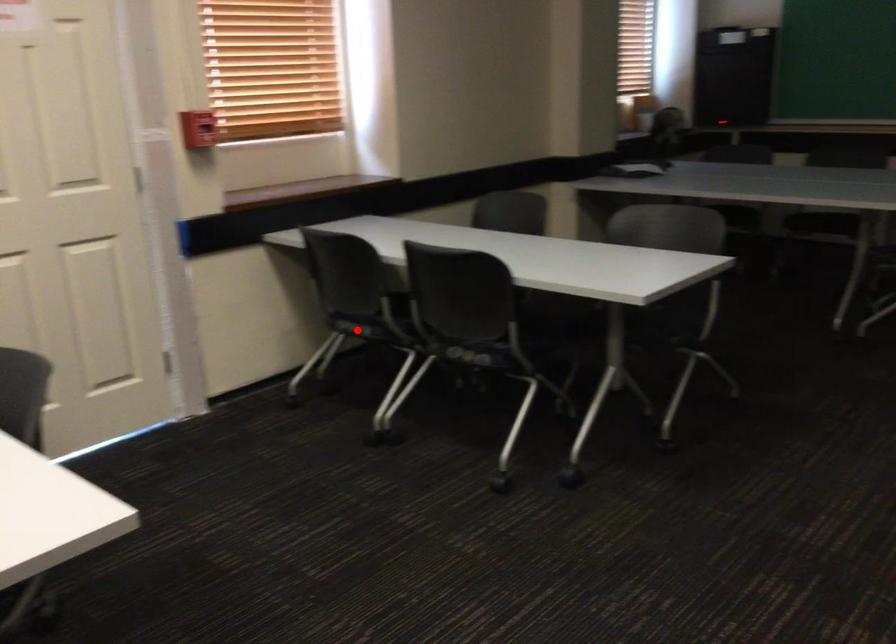
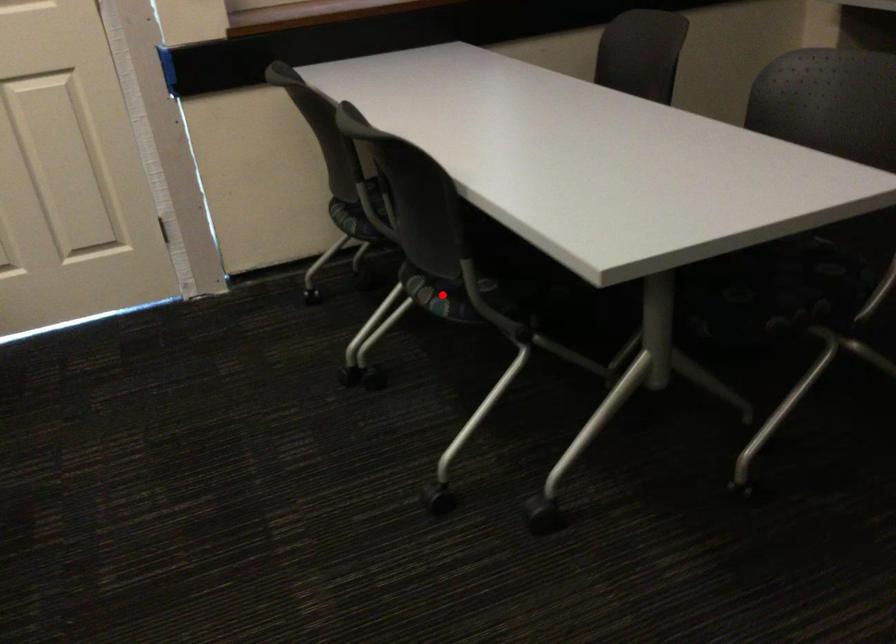
I am providing you with two images of the same scene from different viewpoints. A red point is marked on the first image and another point is marked on the second image. Do the highlighted points in image1 and image2 indicate the same real-world spot?

No